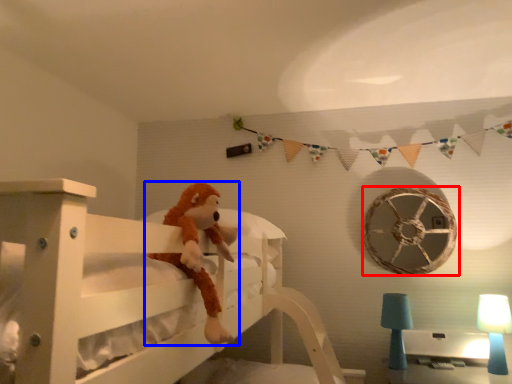
Question: Which of the following is the farthest to the observer, wheel (highlighted by a red box) or toy (highlighted by a blue box)?

Choices:
 (A) wheel
 (B) toy

Answer: (A)